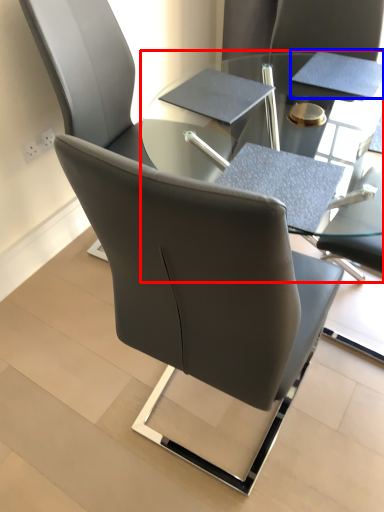
Question: Which of the following is the closest to the observer, table (highlighted by a red box) or notepad (highlighted by a blue box)?

Choices:
 (A) table
 (B) notepad

Answer: (A)